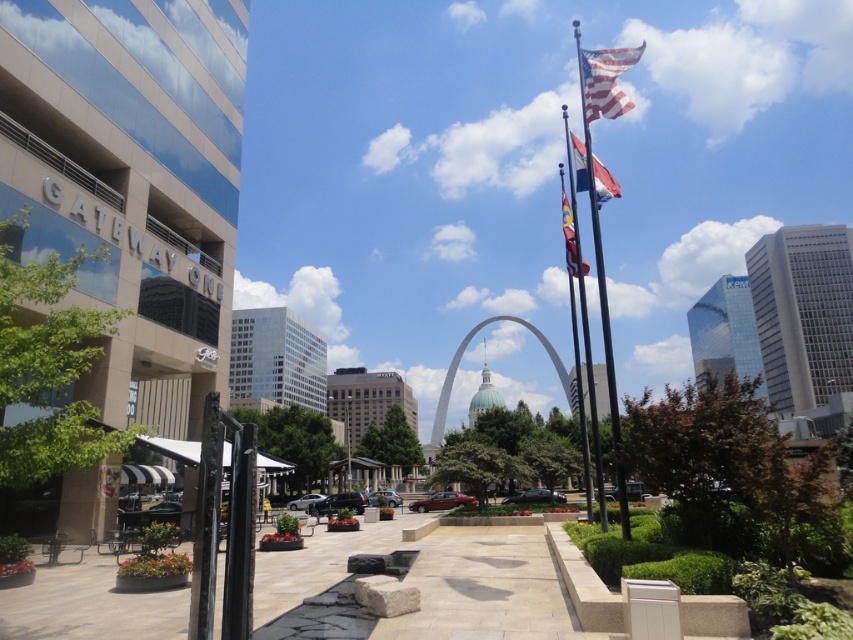
Question: Which point is closer to the camera taking this photo?

Choices:
 (A) (590, 99)
 (B) (613, 365)
 (C) (567, 236)

Answer: (B)

Question: Does metallic flag pole at upper right lie in front of american flag at upper right?

Choices:
 (A) yes
 (B) no

Answer: (A)

Question: Which of these objects is positioned closest to the american flag at upper right?

Choices:
 (A) silky blue flag at upper center
 (B) metallic flag pole at upper right

Answer: (B)

Question: Among these objects, which one is nearest to the camera?

Choices:
 (A) metallic flag pole at upper right
 (B) polyester flag at upper center
 (C) silky blue flag at upper center

Answer: (A)

Question: Is american flag at upper right below silky blue flag at upper center?

Choices:
 (A) yes
 (B) no

Answer: (B)

Question: Observing the image, what is the correct spatial positioning of american flag at upper right in reference to polyester flag at upper center?

Choices:
 (A) below
 (B) above

Answer: (B)